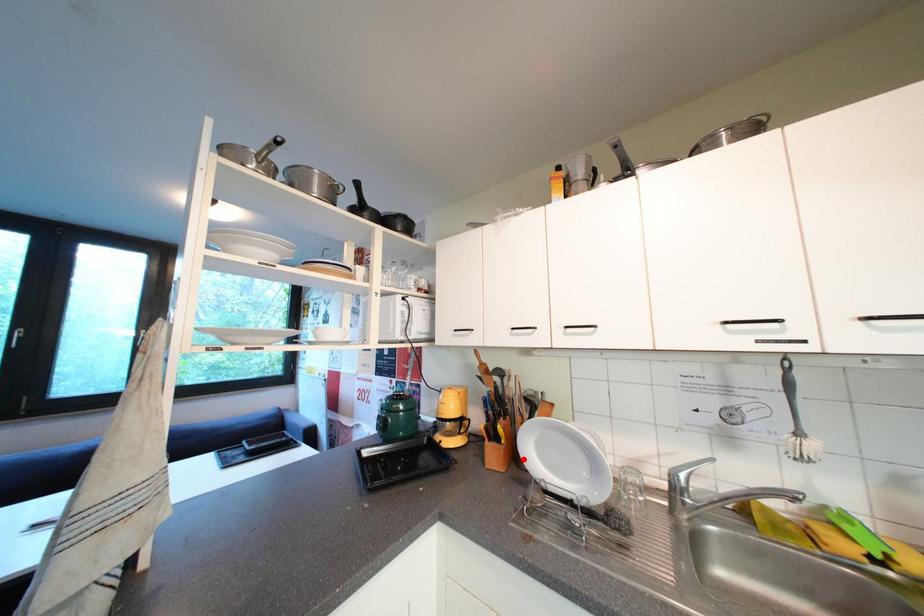
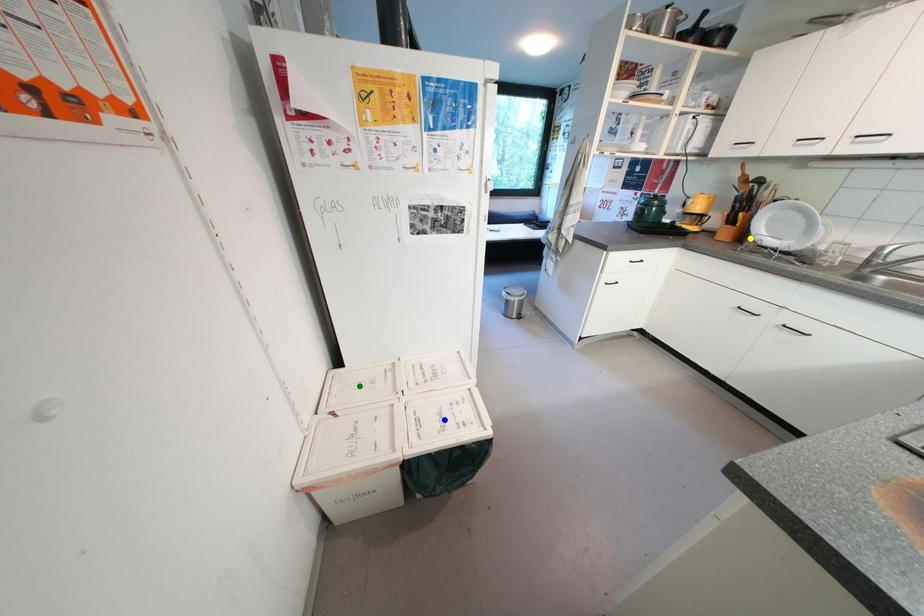
Question: I am providing you with two images of the same scene from different viewpoints. A red point is marked on the first image. You are given multiple points on the second image. Which point in image 2 is actually the same real-world point as the red point in image 1?

Choices:
 (A) blue point
 (B) green point
 (C) yellow point

Answer: (C)